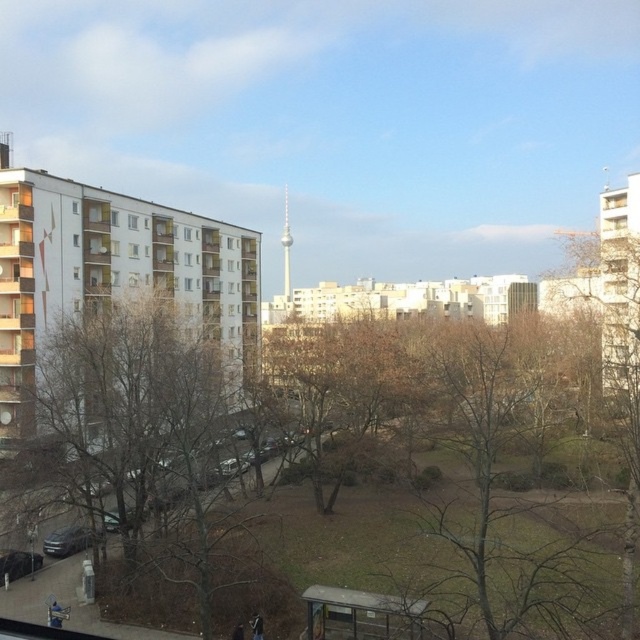
Question: Which of these objects is positioned closest to the silver metallic tv tower at center?

Choices:
 (A) white glass window at upper left
 (B) transparent glass window at upper center

Answer: (A)

Question: From the image, what is the correct spatial relationship of brown leafless tree at center in relation to transparent glass window at upper left?

Choices:
 (A) below
 (B) above

Answer: (A)

Question: Can you confirm if brown leafless tree at center is positioned below transparent glass window at upper left?

Choices:
 (A) no
 (B) yes

Answer: (B)

Question: Which object is closer to the camera taking this photo?

Choices:
 (A) silver metallic tv tower at center
 (B) transparent glass window at upper center
 (C) white glass window at upper left
 (D) brown leafless tree at center

Answer: (D)

Question: Among these objects, which one is nearest to the camera?

Choices:
 (A) silver metallic tv tower at center
 (B) brown leafless tree at left
 (C) white glass window at upper left

Answer: (B)

Question: Can you confirm if silver metallic tv tower at center is positioned to the right of transparent glass window at upper center?

Choices:
 (A) yes
 (B) no

Answer: (A)